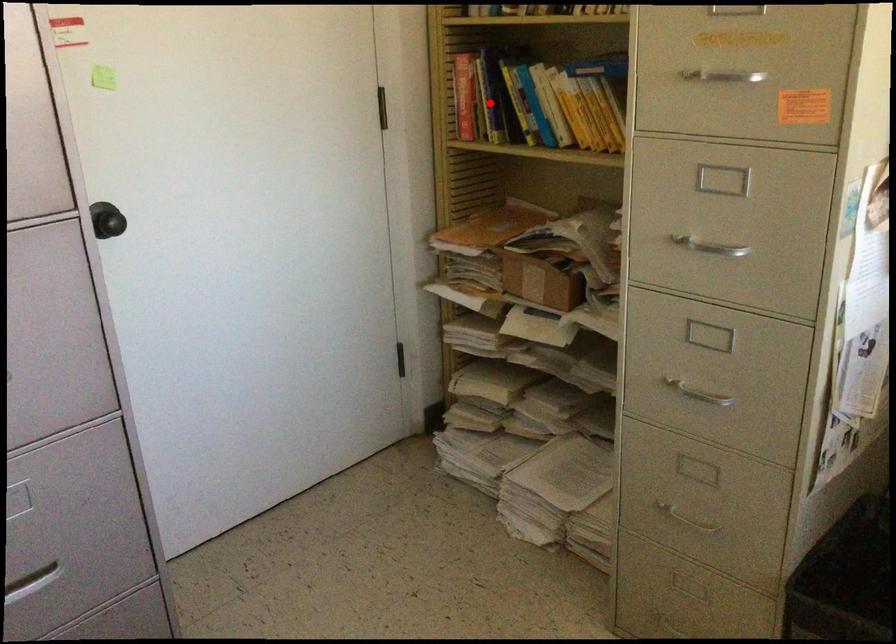
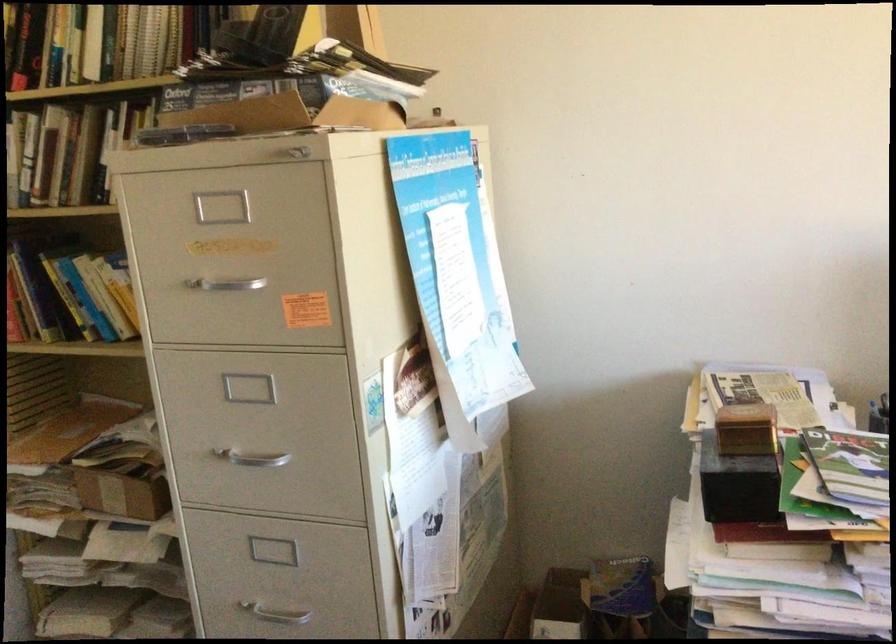
Question: A red point is marked in image1. In image2, is the corresponding 3D point closer to the camera or farther? Reply with the corresponding letter.

Choices:
 (A) The corresponding 3D point is closer.
 (B) The corresponding 3D point is farther.

Answer: (A)